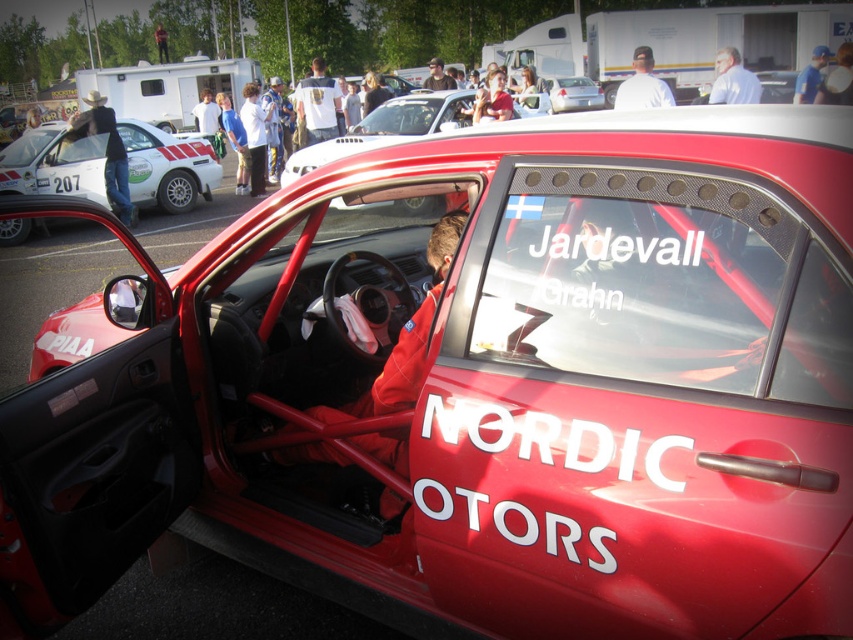
You are standing at point A located at coordinates point A at (204, 131). You want to walk to point B, which is 16.54 meters away from you. Is there enough space for you to walk directly to point B without any obstacles?

The distance between point A at (204, 131) and point B is 16.54 meters. Since the scene shows an open area with no mentioned obstacles, you can walk directly to point B without any issues.

From the picture: You are standing in a parking lot and see the matte red car at center. If you want to touch the car, how many steps do you need to take if each step covers 0.75 meters?

The matte red car at center is 2.28 meters away. Each step covers 0.75 meters. Dividing 2.28 by 0.75 gives approximately 3.04 steps. Since you can only take whole steps, you would need to take 4 steps to reach the matte red car at center.